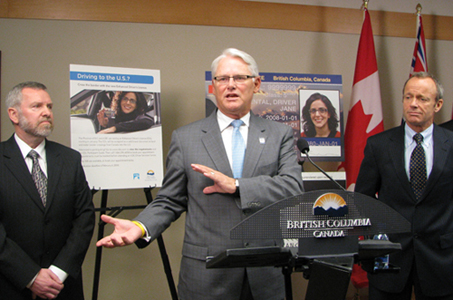
Where is `easel legs`? easel legs is located at coordinates (100, 271), (161, 262).